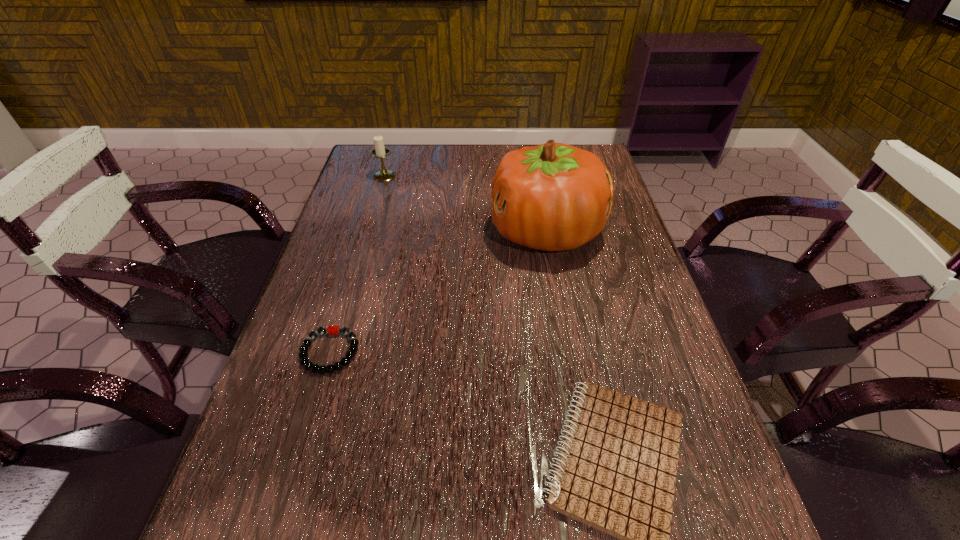
Identify the location of free space between the bracelet and the candle holder. Image resolution: width=960 pixels, height=540 pixels. (357, 264).

The height and width of the screenshot is (540, 960). In order to click on vacant area that lies between the second farthest object and the candle holder in this screenshot , I will do pos(466,204).

This screenshot has height=540, width=960. In order to click on vacant region between the candle holder and the bracelet in this screenshot , I will do `click(357, 264)`.

Image resolution: width=960 pixels, height=540 pixels. What are the coordinates of `unoccupied position between the second tallest object and the bracelet` in the screenshot? It's located at (357, 264).

Where is `empty location between the shortest object and the pumpkin`? The width and height of the screenshot is (960, 540). empty location between the shortest object and the pumpkin is located at coordinates (438, 292).

Where is `object that stands as the closest to the third tallest object`? Image resolution: width=960 pixels, height=540 pixels. object that stands as the closest to the third tallest object is located at coordinates (553, 197).

Select which object appears as the third closest to the nearest object. Please provide its 2D coordinates. Your answer should be formatted as a tuple, i.e. [(x, y)], where the tuple contains the x and y coordinates of a point satisfying the conditions above.

[(380, 151)]